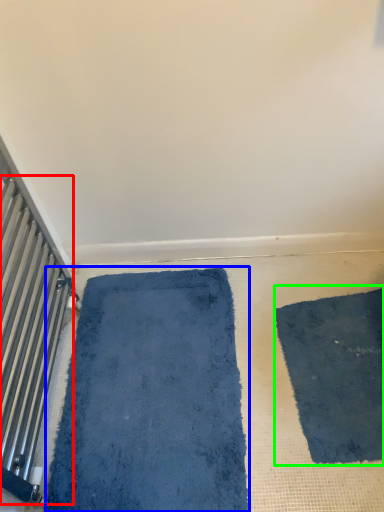
Question: Considering the real-world distances, which object is farthest from radiator (highlighted by a red box)? bath mat (highlighted by a blue box) or mat (highlighted by a green box)?

Choices:
 (A) bath mat
 (B) mat

Answer: (B)